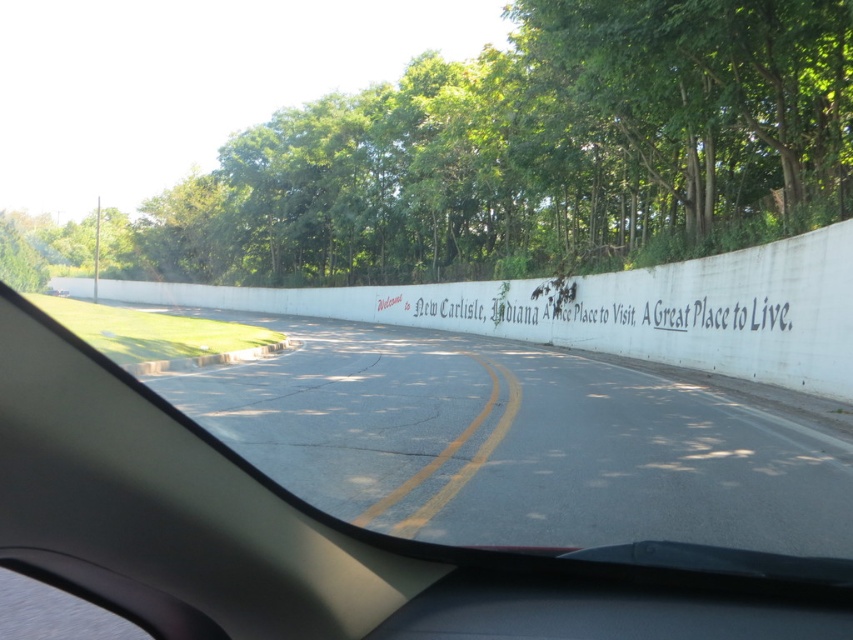
Question: Which of the following is the closest to the observer?

Choices:
 (A) white concrete wall at center
 (B) white painted text at center
 (C) green leafy trees at upper center

Answer: (A)

Question: Does green leafy trees at upper center appear over white painted text at center?

Choices:
 (A) no
 (B) yes

Answer: (B)

Question: Which object is closer to the camera taking this photo?

Choices:
 (A) white painted text at center
 (B) green leafy trees at upper center

Answer: (B)

Question: In this image, where is green leafy trees at upper center located relative to white painted text at center?

Choices:
 (A) above
 (B) below

Answer: (A)

Question: Does white concrete wall at center have a smaller size compared to white painted text at center?

Choices:
 (A) yes
 (B) no

Answer: (A)

Question: Which of the following is the farthest from the observer?

Choices:
 (A) white painted text at center
 (B) white concrete wall at center

Answer: (A)